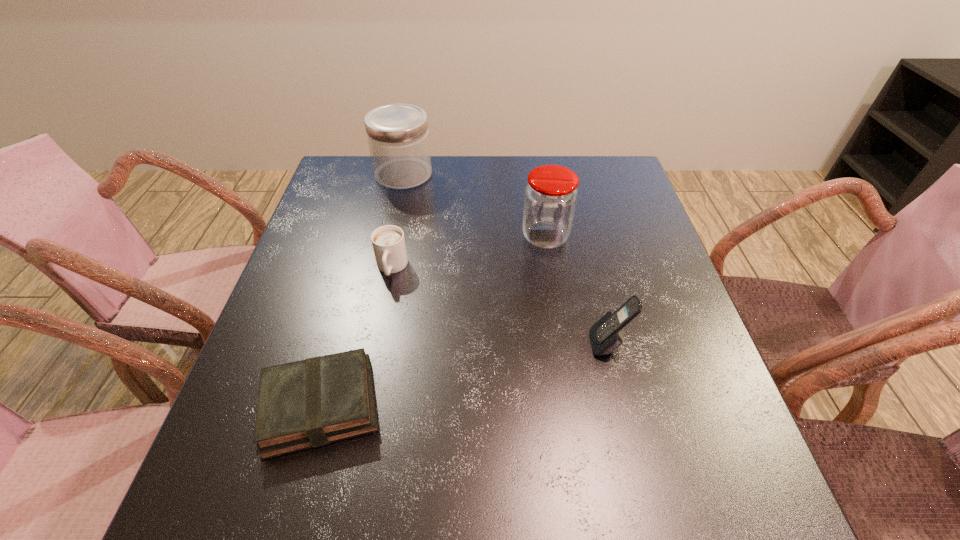
I want to click on free space located 0.050m on the front-facing side of the fourth farthest object, so click(565, 344).

I want to click on vacant space located on the front-facing side of the fourth farthest object, so click(x=556, y=344).

Identify the location of vacant region located 0.300m on the front-facing side of the fourth farthest object. Image resolution: width=960 pixels, height=540 pixels. (442, 344).

This screenshot has width=960, height=540. I want to click on vacant space positioned 0.170m on the side with the handle of the second shortest object, so click(376, 347).

The image size is (960, 540). Find the location of `free spot located on the front of the book`. free spot located on the front of the book is located at coordinates (291, 514).

Where is `object present at the far edge`? object present at the far edge is located at coordinates (398, 137).

Identify the location of jar located in the left edge section of the desktop. Image resolution: width=960 pixels, height=540 pixels. (398, 137).

Locate an element on the screen. The image size is (960, 540). book present at the left edge is located at coordinates 314,402.

I want to click on object located in the right edge section of the desktop, so click(606, 336).

Locate an element on the screen. The height and width of the screenshot is (540, 960). object that is at the far left corner is located at coordinates (398, 137).